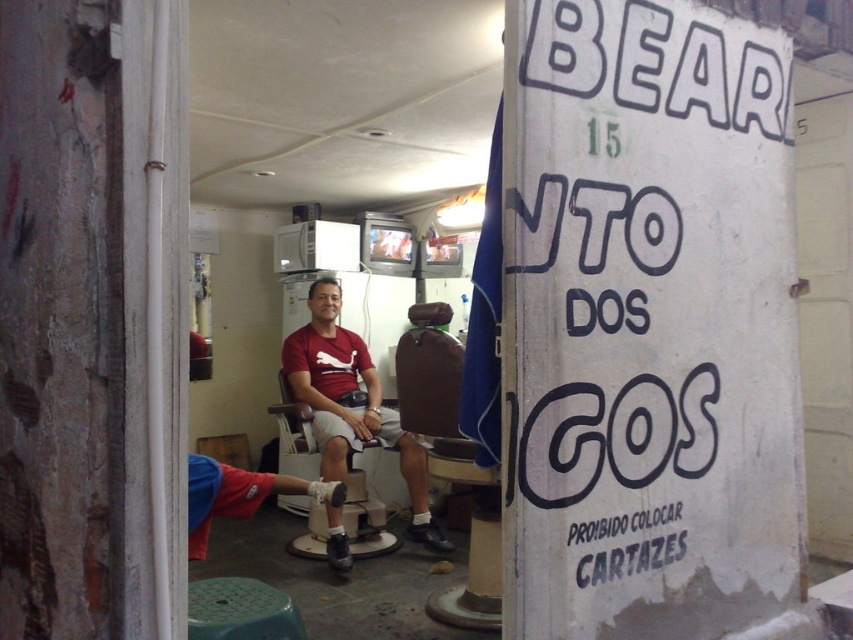
You are a customer entering the barbershop and see the brown leather chair at center and the green plastic stool at lower left. Which object is positioned higher from the ground?

The brown leather chair at center is located above the green plastic stool at lower left, so it is higher from the ground.

You are standing at the point marked as point (421, 456) in the barbershop scene. You want to hand a small item to the person sitting in the barber chair. Can you reach them without moving from your current position?

The distance between you and the person in the barber chair is 13.55 feet. Since this distance is quite large, it would be difficult to reach them without moving closer.

You are a delivery person who needs to place a small package between the matte plastic chair at center and the brown matte hair at center. The package is 1.2 meters long. Will it fit in the space between them?

The distance between the matte plastic chair at center and the brown matte hair at center is 1.07 meters, which is shorter than the 1.2 meter package. The package will not fit in the space between them.